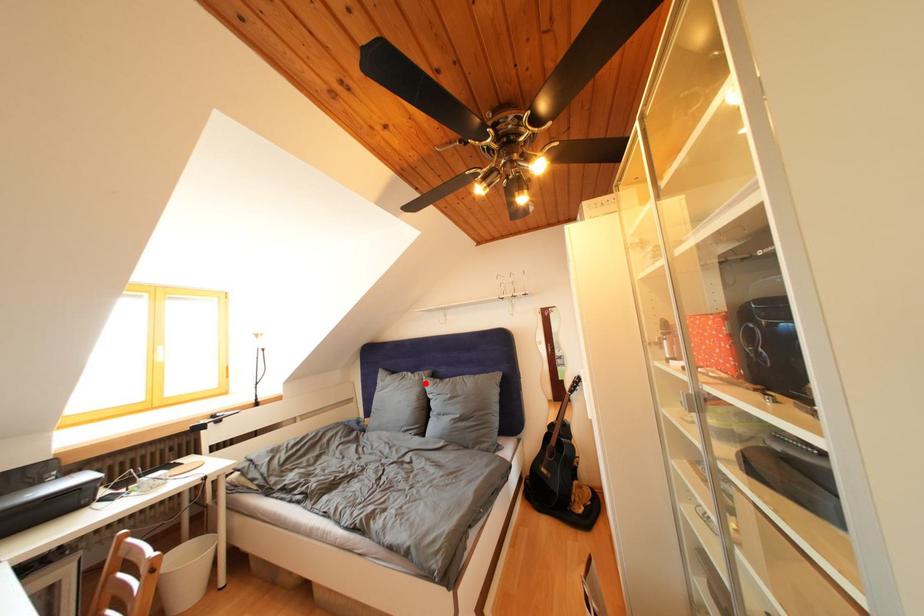
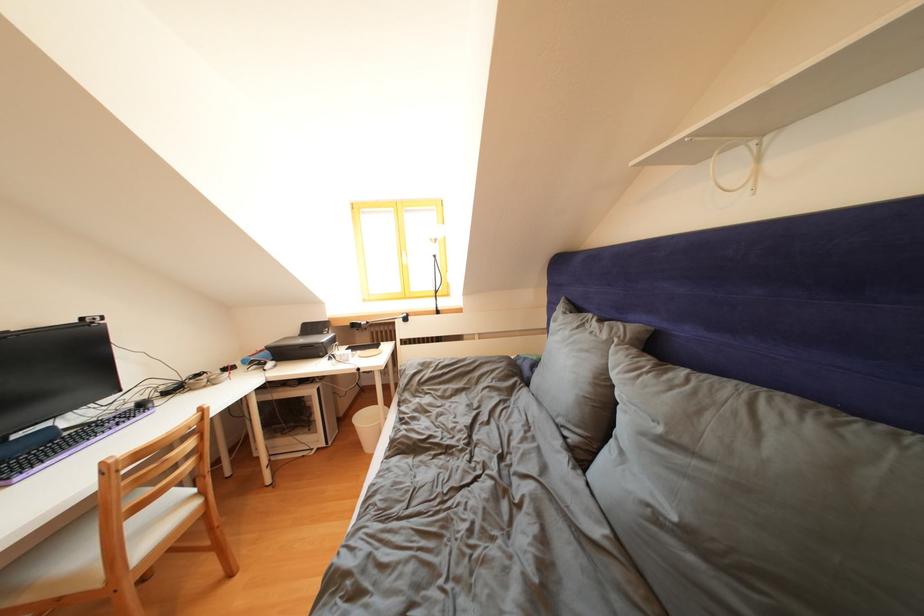
In the second image, find the point that corresponds to the highlighted location in the first image.

(612, 341)